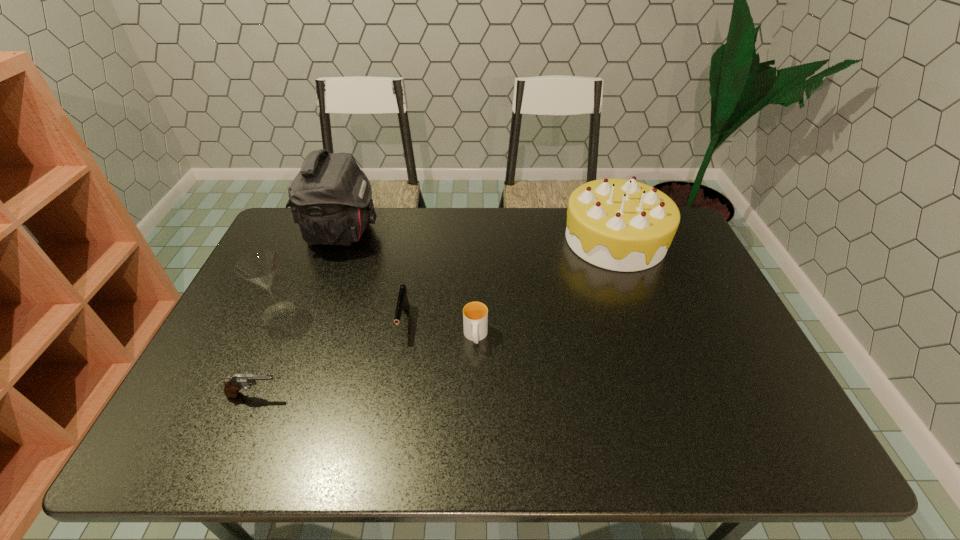
At what (x,y) coordinates should I click in order to perform the action: click on object that is at the far left corner. Please return your answer as a coordinate pair (x, y). The image size is (960, 540). Looking at the image, I should click on (330, 198).

At what (x,y) coordinates should I click in order to perform the action: click on object that is at the far right corner. Please return your answer as a coordinate pair (x, y). The width and height of the screenshot is (960, 540). Looking at the image, I should click on (622, 225).

This screenshot has height=540, width=960. I want to click on free space at the far edge of the desktop, so click(x=507, y=233).

At what (x,y) coordinates should I click in order to perform the action: click on vacant space at the left edge of the desktop. Please return your answer as a coordinate pair (x, y). Looking at the image, I should click on point(269,330).

In the image, there is a desktop. Where is `vacant space at the right edge`? This screenshot has height=540, width=960. vacant space at the right edge is located at coordinates (740, 378).

The width and height of the screenshot is (960, 540). In order to click on free spot at the far left corner of the desktop in this screenshot , I will do `click(304, 249)`.

What are the coordinates of `free space between the rightmost object and the cup` in the screenshot? It's located at (545, 288).

The height and width of the screenshot is (540, 960). What are the coordinates of `empty space that is in between the fourth object from left to right and the left pistol` in the screenshot? It's located at (329, 358).

Image resolution: width=960 pixels, height=540 pixels. In order to click on free space between the cup and the shoulder bag in this screenshot , I will do `click(409, 285)`.

The height and width of the screenshot is (540, 960). I want to click on vacant region between the tallest object and the fifth object from left to right, so click(x=409, y=285).